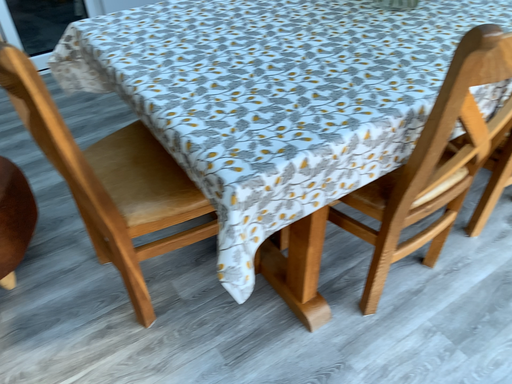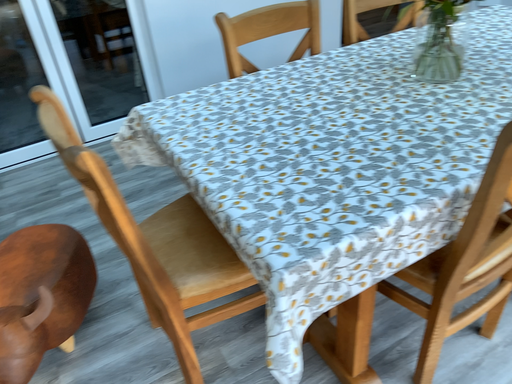
Question: How did the camera likely rotate when shooting the video?

Choices:
 (A) rotated left
 (B) rotated right

Answer: (A)